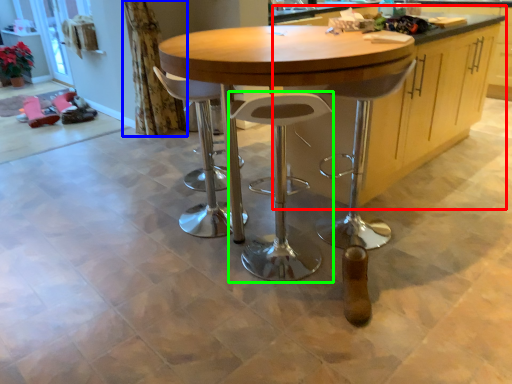
Question: Which object is positioned farthest from cabinetry (highlighted by a red box)? Select from curtain (highlighted by a blue box) and stool (highlighted by a green box).

Choices:
 (A) curtain
 (B) stool

Answer: (A)